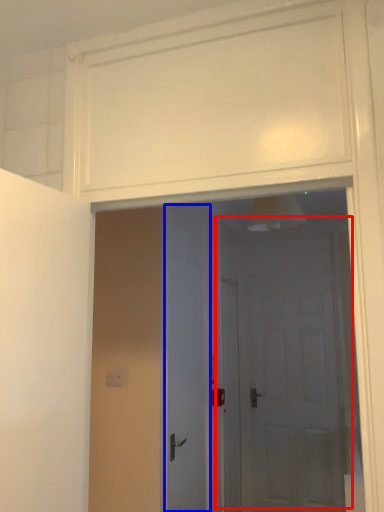
Question: Which object is further to the camera taking this photo, door (highlighted by a red box) or door (highlighted by a blue box)?

Choices:
 (A) door
 (B) door

Answer: (A)